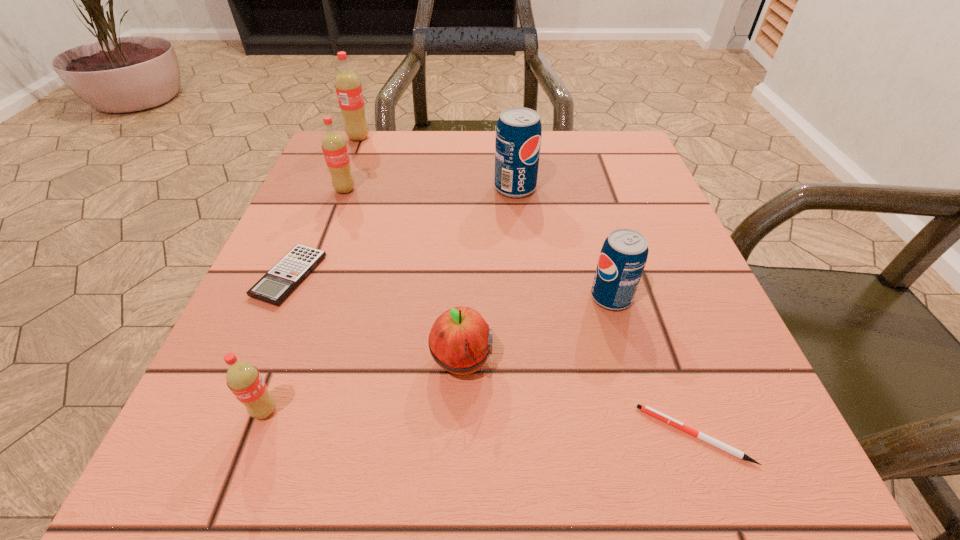
Where is `free space located 0.350m on the right of the second shortest object`? free space located 0.350m on the right of the second shortest object is located at coordinates (531, 276).

Locate an element on the screen. Image resolution: width=960 pixels, height=540 pixels. vacant area situated 0.060m on the clicker of the white pen is located at coordinates (593, 435).

Where is `free space located 0.400m on the clicker of the white pen`? The height and width of the screenshot is (540, 960). free space located 0.400m on the clicker of the white pen is located at coordinates (315, 435).

I want to click on vacant region located 0.400m on the clicker of the white pen, so click(315, 435).

You are a GUI agent. You are given a task and a screenshot of the screen. Output one action in this format:
    pyautogui.click(x=<x>, y=<y>)
    Task: Click on the object that is positioned at the near edge
    
    Given the screenshot: What is the action you would take?
    pyautogui.click(x=735, y=452)

This screenshot has height=540, width=960. What are the coordinates of `calculator present at the left edge` in the screenshot? It's located at [279, 282].

You are a GUI agent. You are given a task and a screenshot of the screen. Output one action in this format:
    pyautogui.click(x=<x>, y=<y>)
    Task: Click on the pop that is positioned at the right edge
    
    Given the screenshot: What is the action you would take?
    pyautogui.click(x=623, y=256)

I want to click on pen that is at the right edge, so click(735, 452).

Locate an element on the screen. The height and width of the screenshot is (540, 960). object located at the near right corner is located at coordinates (735, 452).

This screenshot has height=540, width=960. Find the location of `free region at the far edge of the desktop`. free region at the far edge of the desktop is located at coordinates (485, 136).